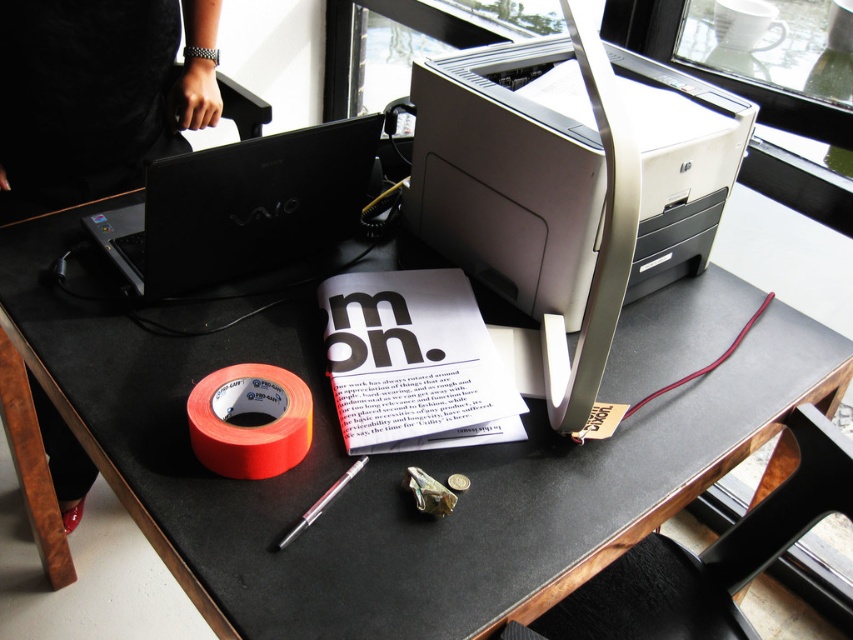
Looking at this image, who is positioned more to the left, beige plastic printer at center or orange matte tape at lower left?

Positioned to the left is orange matte tape at lower left.

Consider the image. Does beige plastic printer at center have a greater width compared to orange matte tape at lower left?

Yes.

I want to click on beige plastic printer at center, so click(x=569, y=189).

Is black matte laptop at upper left smaller than orange matte tape at lower left?

Actually, black matte laptop at upper left might be larger than orange matte tape at lower left.

Does black matte laptop at upper left lie behind orange matte tape at lower left?

Yes, it is.

Who is more distant from viewer, (283,163) or (299,400)?

Point (283,163)

Image resolution: width=853 pixels, height=640 pixels. Find the location of `black matte laptop at upper left`. black matte laptop at upper left is located at coordinates (241, 205).

Is black matte laptop at upper left taller than metallic silver pen at center?

Yes, black matte laptop at upper left is taller than metallic silver pen at center.

Is point (170, 276) positioned behind point (299, 522)?

Yes, it is.

In order to click on black matte laptop at upper left in this screenshot , I will do `click(241, 205)`.